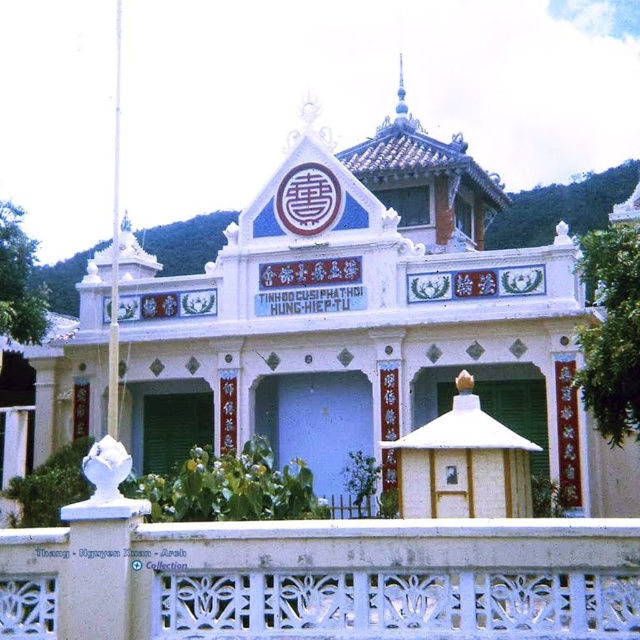
You are standing in front of the traditional building and want to cross the white carved stone balustrade at lower center to reach the white painted wood palace at center. Is the balustrade directly under the palace, making it possible to step onto it from the palace?

The white painted wood palace at center is positioned over the white carved stone balustrade at lower center, so yes, the balustrade is directly underneath the palace. You can step onto the balustrade from the palace.

What are the coordinates of the white painted wood palace at center?

The coordinates of the white painted wood palace at center are at point (362, 321).

In the scene shown: You are an architect planning to install a new decorative element between the white painted wood palace at center and the white carved stone balustrade at lower center. The element requires a minimum distance of 40 meters between the two objects to be installed safely. Based on the scene description, can the element be placed between them?

The white painted wood palace at center is 39.39 meters from the white carved stone balustrade at lower center. Since the required minimum distance is 40 meters, the element cannot be safely installed between them.